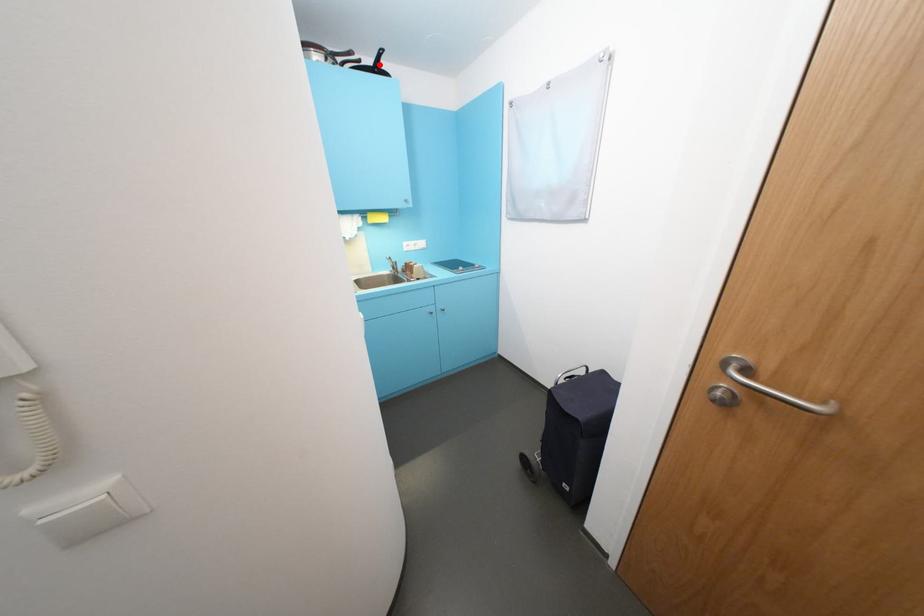
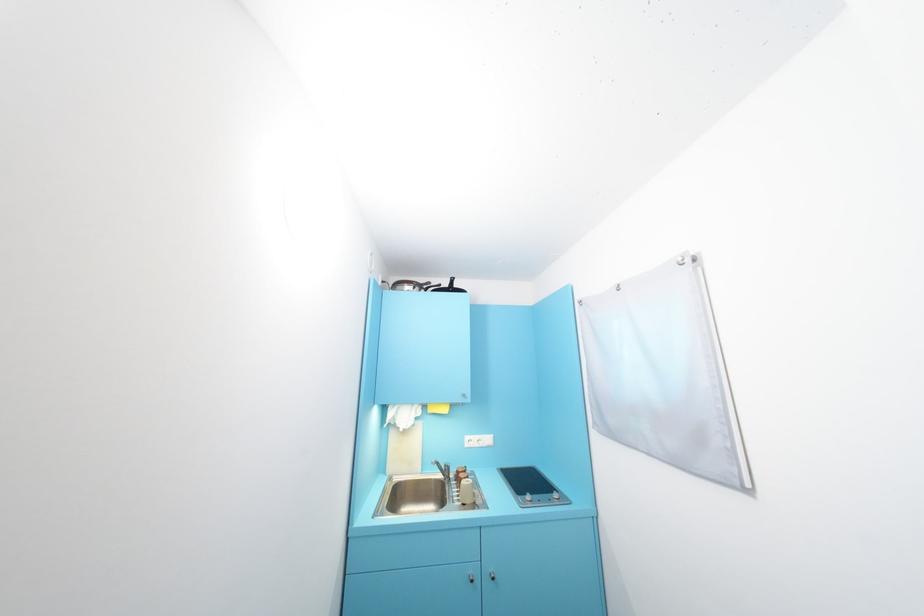
Find the pixel in the second image that matches the highlighted location in the first image.

(455, 286)